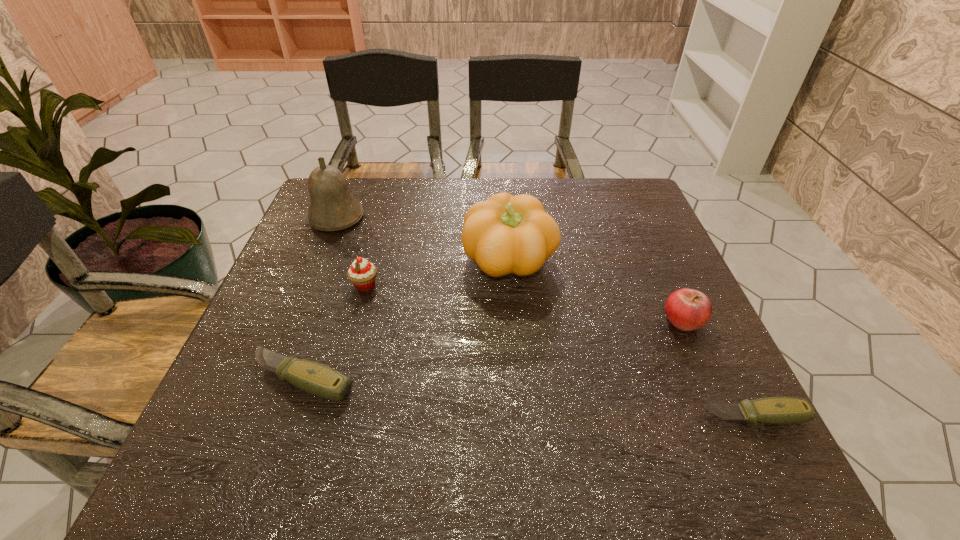
Identify the location of object at the near left corner. coord(315,378).

I want to click on object present at the near right corner, so click(771, 410).

This screenshot has height=540, width=960. What are the coordinates of `vacant area at the far edge of the desktop` in the screenshot? It's located at (537, 189).

Locate an element on the screen. vacant space at the near edge of the desktop is located at coordinates (354, 400).

Locate an element on the screen. free spot at the left edge of the desktop is located at coordinates (303, 317).

You are a GUI agent. You are given a task and a screenshot of the screen. Output one action in this format:
    pyautogui.click(x=<x>, y=<y>)
    Task: Click on the free space at the right edge of the desktop
    The image size is (960, 540).
    Given the screenshot: What is the action you would take?
    pyautogui.click(x=672, y=277)

Find the location of a particular element. This screenshot has height=540, width=960. free region at the far right corner of the desktop is located at coordinates (657, 221).

Image resolution: width=960 pixels, height=540 pixels. In order to click on free space at the near right corner in this screenshot , I will do `click(699, 416)`.

You are a GUI agent. You are given a task and a screenshot of the screen. Output one action in this format:
    pyautogui.click(x=<x>, y=<y>)
    Task: Click on the free spot between the taller pocketknife and the fourth object from left to right
    
    Given the screenshot: What is the action you would take?
    pyautogui.click(x=406, y=320)

Locate an element on the screen. This screenshot has height=540, width=960. vacant point located between the cupcake and the third nearest object is located at coordinates (524, 302).